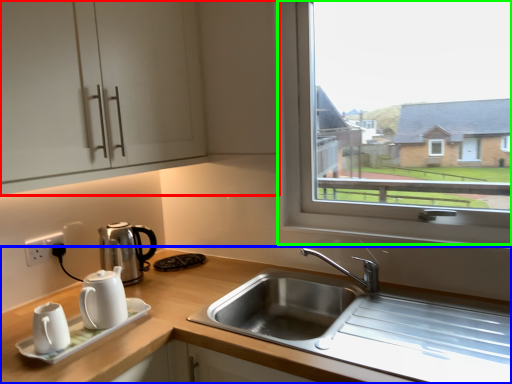
Question: Which is nearer to the cabinetry (highlighted by a red box)? countertop (highlighted by a blue box) or window (highlighted by a green box).

Choices:
 (A) countertop
 (B) window

Answer: (B)